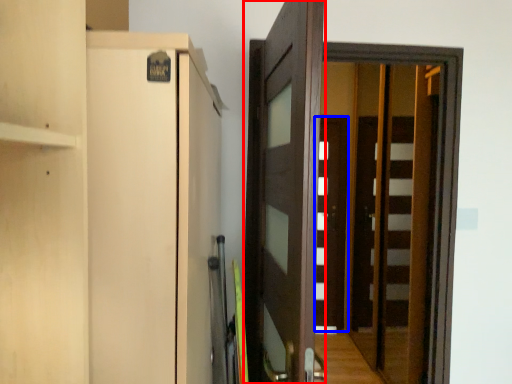
Question: Which of the following is the farthest to the observer, door (highlighted by a red box) or door (highlighted by a blue box)?

Choices:
 (A) door
 (B) door

Answer: (B)